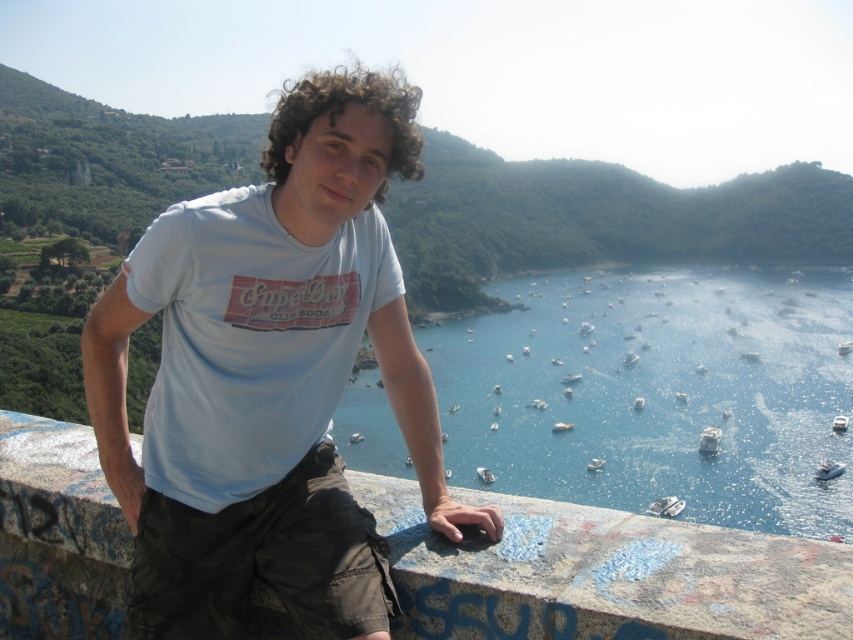
Question: Does blue water at center have a smaller size compared to granite ledge at center?

Choices:
 (A) yes
 (B) no

Answer: (B)

Question: Is granite ledge at center thinner than light blue cotton t-shirt at center?

Choices:
 (A) no
 (B) yes

Answer: (A)

Question: Based on their relative distances, which object is farther from the white plastic boat at center?

Choices:
 (A) blue water at center
 (B) light blue cotton t-shirt at center
 (C) white plastic boat at lower right
 (D) light blue t-shirt at center

Answer: (B)

Question: Is light blue cotton t-shirt at center to the right of white plastic boat at center from the viewer's perspective?

Choices:
 (A) no
 (B) yes

Answer: (A)

Question: Among these objects, which one is nearest to the camera?

Choices:
 (A) light blue t-shirt at center
 (B) white plastic boat at center

Answer: (A)

Question: Considering the real-world distances, which object is farthest from the light blue cotton t-shirt at center?

Choices:
 (A) granite ledge at center
 (B) blue water at center
 (C) white plastic boat at center
 (D) light blue t-shirt at center

Answer: (B)